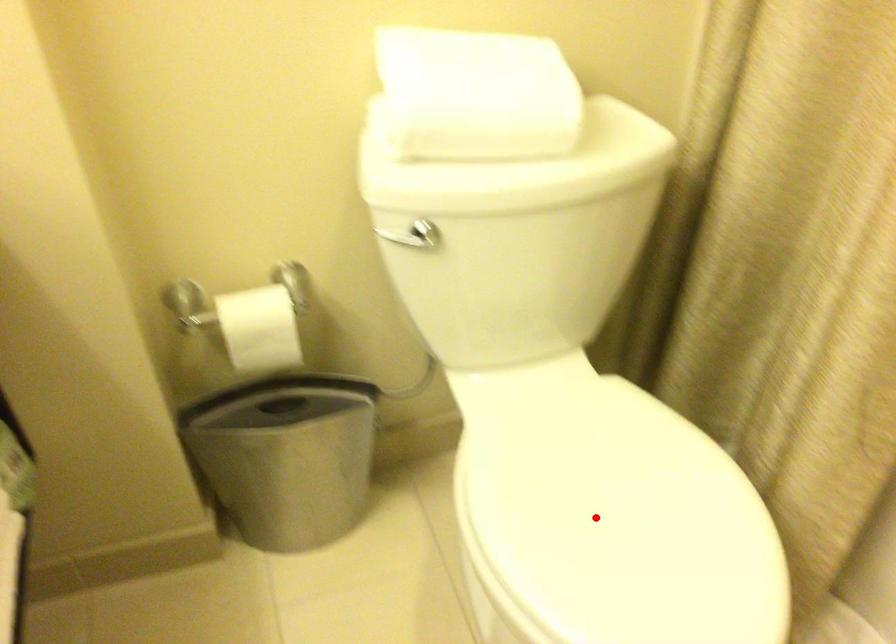
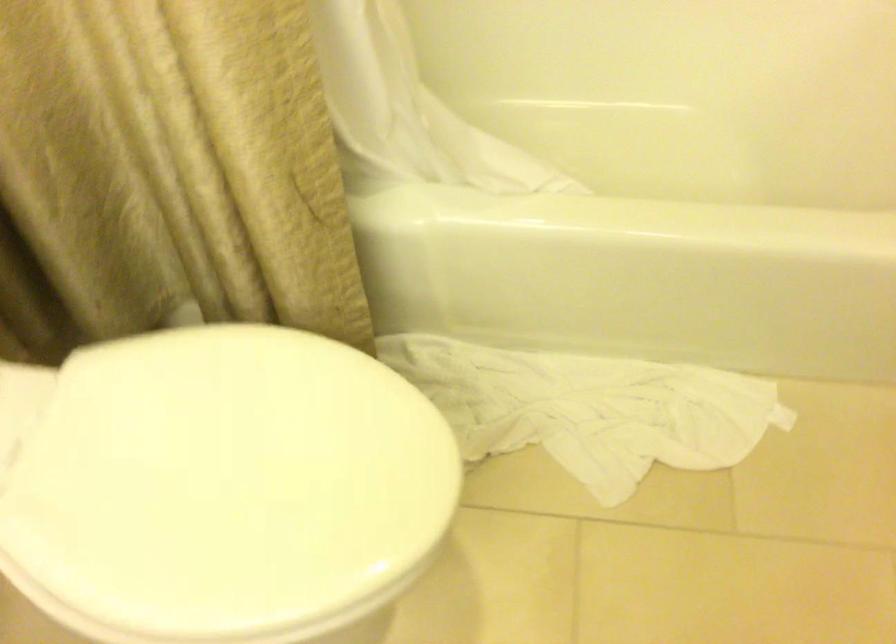
Locate, in the second image, the point that corresponds to the highlighted location in the first image.

(219, 484)